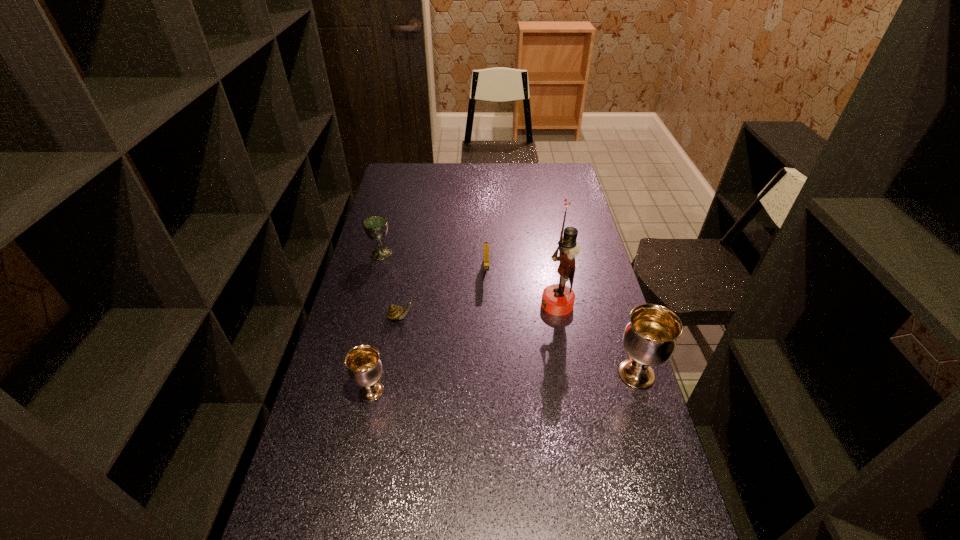
Identify which object is the fourth closest to the second object from right to left. Please provide its 2D coordinates. Your answer should be formatted as a tuple, i.e. [(x, y)], where the tuple contains the x and y coordinates of a point satisfying the conditions above.

[(365, 369)]

Select which object is the second closest to the snail. Please provide its 2D coordinates. Your answer should be formatted as a tuple, i.e. [(x, y)], where the tuple contains the x and y coordinates of a point satisfying the conditions above.

[(486, 246)]

At what (x,y) coordinates should I click in order to perform the action: click on the closest chalice to the pistol. Please return your answer as a coordinate pair (x, y). Image resolution: width=960 pixels, height=540 pixels. Looking at the image, I should click on (376, 227).

Locate an element on the screen. the second closest chalice to the pistol is located at coordinates (649, 339).

What are the coordinates of `free point that satisfies the following two spatial constraints: 1. on the face of the rightmost object; 2. on the left side of the snail` in the screenshot? It's located at (391, 374).

I want to click on vacant region that satisfies the following two spatial constraints: 1. at the barrel of the third object from right to left; 2. on the left side of the rightmost chalice, so click(488, 374).

Identify the location of vacant position in the image that satisfies the following two spatial constraints: 1. at the barrel of the pistol; 2. on the right side of the tallest chalice. The height and width of the screenshot is (540, 960). (488, 374).

Identify the location of free space that satisfies the following two spatial constraints: 1. on the face of the snail; 2. on the right side of the rightmost chalice. (391, 374).

I want to click on blank area in the image that satisfies the following two spatial constraints: 1. on the front-facing side of the tallest object; 2. on the back side of the tallest chalice, so click(x=570, y=374).